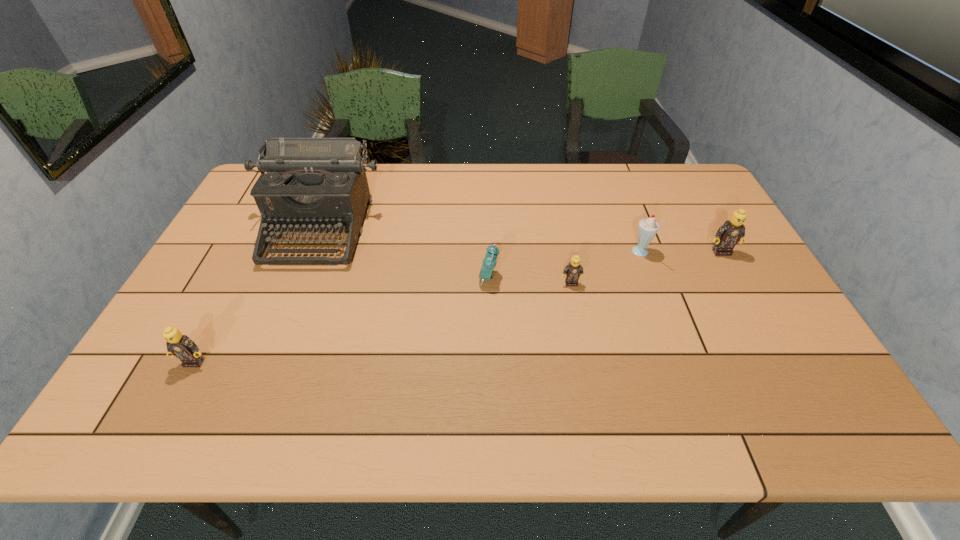
Identify the location of the second shortest Lego. (181, 346).

You are a GUI agent. You are given a task and a screenshot of the screen. Output one action in this format:
    pyautogui.click(x=<x>, y=<y>)
    Task: Click on the leftmost Lego
    This screenshot has height=540, width=960.
    Given the screenshot: What is the action you would take?
    pyautogui.click(x=181, y=346)

Find the location of a particular element. the second nearest Lego is located at coordinates (572, 272).

Locate an element on the screen. the fourth object from left to right is located at coordinates (572, 272).

At what (x,y) coordinates should I click in order to perform the action: click on the rightmost Lego. Please return your answer as a coordinate pair (x, y). This screenshot has height=540, width=960. Looking at the image, I should click on (732, 231).

In order to click on the tallest Lego in this screenshot , I will do `click(732, 231)`.

You are a GUI agent. You are given a task and a screenshot of the screen. Output one action in this format:
    pyautogui.click(x=<x>, y=<y>)
    Task: Click on the typewriter
    The height and width of the screenshot is (540, 960).
    Given the screenshot: What is the action you would take?
    pyautogui.click(x=313, y=184)

Find the location of `alarm clock`. alarm clock is located at coordinates (489, 262).

You are a GUI agent. You are given a task and a screenshot of the screen. Output one action in this format:
    pyautogui.click(x=<x>, y=<y>)
    Task: Click on the second object from right to left
    This screenshot has width=960, height=540.
    Given the screenshot: What is the action you would take?
    pyautogui.click(x=647, y=228)

Where is `vacant space located 0.130m in front of the second nearest Lego`? The image size is (960, 540). vacant space located 0.130m in front of the second nearest Lego is located at coordinates (579, 325).